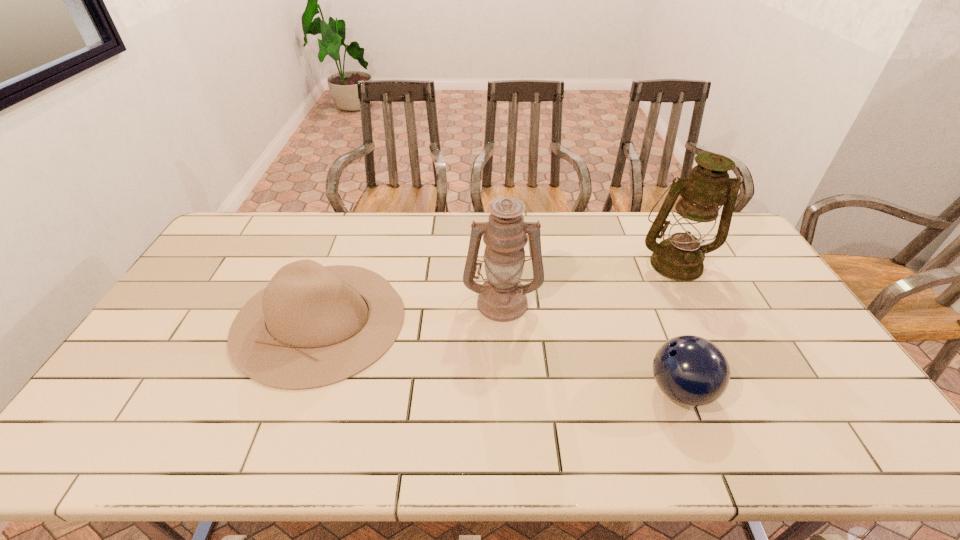
This screenshot has width=960, height=540. Identify the location of the right oil lamp. (680, 257).

This screenshot has width=960, height=540. Find the location of `the second object from left to right`. the second object from left to right is located at coordinates (502, 298).

This screenshot has width=960, height=540. Find the location of `the nearer oil lamp`. the nearer oil lamp is located at coordinates (502, 298).

Identify the location of sombrero. (310, 327).

Find the location of a particular element. bowling ball is located at coordinates (690, 370).

What are the coordinates of `free spot located on the back of the right oil lamp` in the screenshot? It's located at (660, 234).

At what (x,y) coordinates should I click in order to perform the action: click on free space located 0.050m on the left of the second object from left to right. Please return your answer as a coordinate pair (x, y). Image resolution: width=960 pixels, height=540 pixels. Looking at the image, I should click on (447, 301).

Image resolution: width=960 pixels, height=540 pixels. In order to click on vacant space positioned 0.160m on the back of the sombrero in this screenshot , I will do `click(349, 238)`.

Locate an element on the screen. vacant space positioned on the surface of the bowling ball near the finger holes is located at coordinates (596, 390).

Where is `free space located 0.050m on the surface of the bowling ball near the finger holes`? The height and width of the screenshot is (540, 960). free space located 0.050m on the surface of the bowling ball near the finger holes is located at coordinates (627, 390).